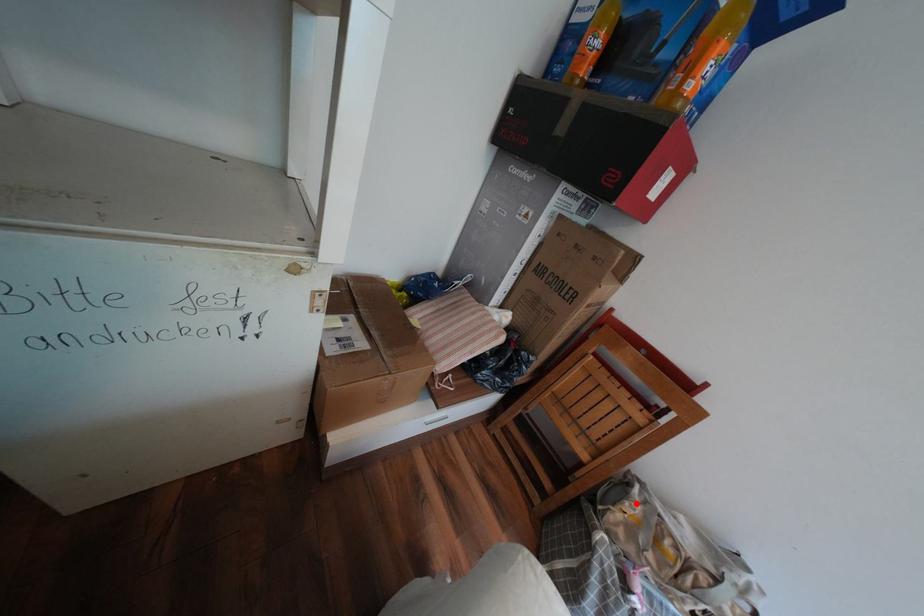
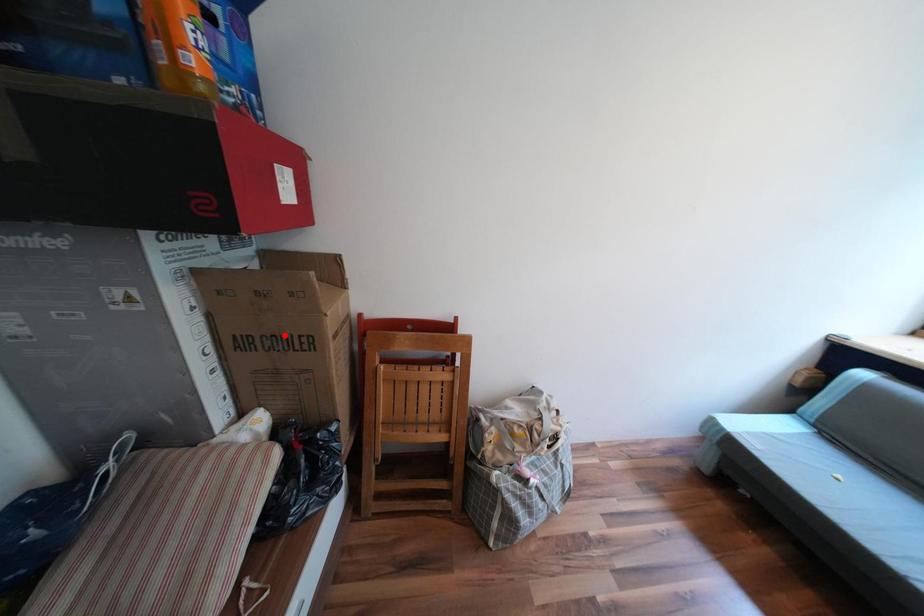
I am providing you with two images of the same scene from different viewpoints. A red point is marked on the first image and another point is marked on the second image. Is the red point in image1 aligned with the point shown in image2?

No